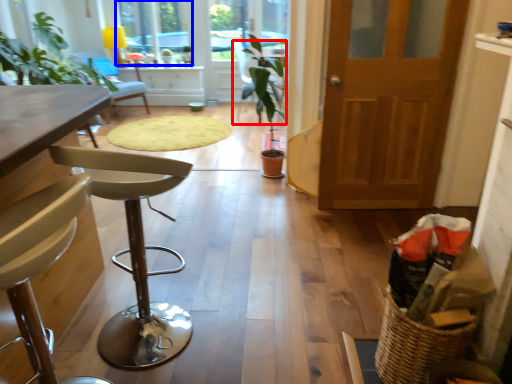
Question: Among these objects, which one is farthest to the camera, chair (highlighted by a red box) or window (highlighted by a blue box)?

Choices:
 (A) chair
 (B) window

Answer: (B)